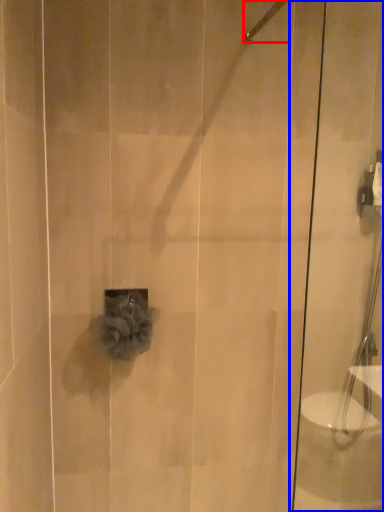
Question: Which point is further to the camera, shower (highlighted by a red box) or shower door (highlighted by a blue box)?

Choices:
 (A) shower
 (B) shower door

Answer: (A)